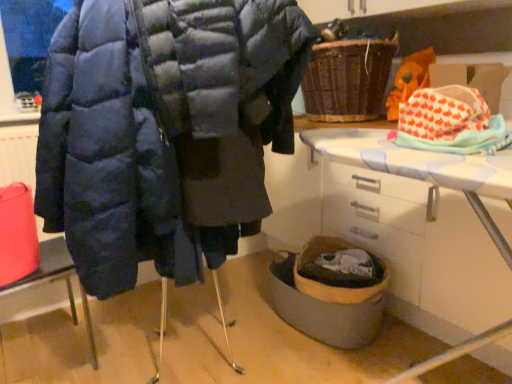
Locate an element on the screen. The width and height of the screenshot is (512, 384). free space behind matte black coat at left is located at coordinates (91, 314).